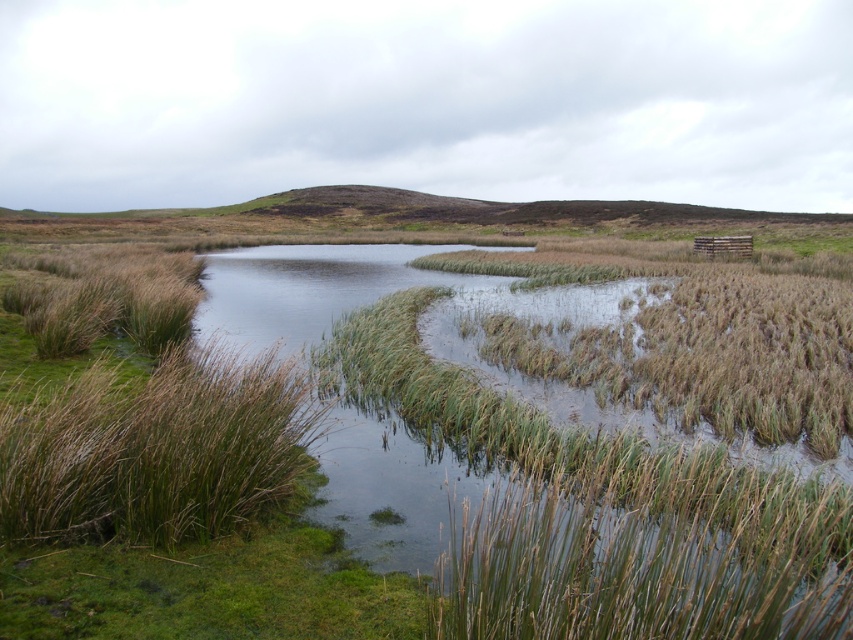
You are a small animal that needs to cross from the brown grass at left to the brown grass at lower center. Can you make the jump? The maximum distance you can jump is 9 feet.

The distance between the brown grass at lower center and brown grass at left is 9.59 feet, which is greater than your maximum jump distance of 9 feet. Therefore, you cannot make the jump.

You are standing in the landscape scene and want to walk from the brown grass at left to the brown grass at lower center. Which direction should you move in?

You should move to the right to reach the brown grass at lower center from the brown grass at left because the brown grass at lower center is positioned to the right of the brown grass at left.

You are standing at the edge of the water in the scene. You need to place a small wooden sign exactly at the coordinates provided in the description. Where should you place the sign relative to the brown grass at lower center?

The brown grass at lower center is located at coordinates point (624, 573), so you should place the sign exactly at that position relative to the brown grass at lower center.